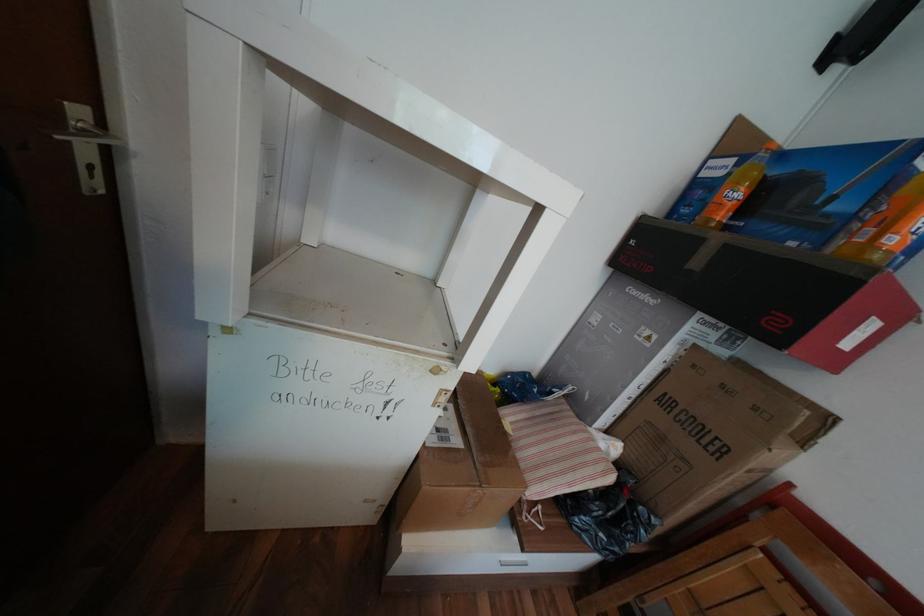
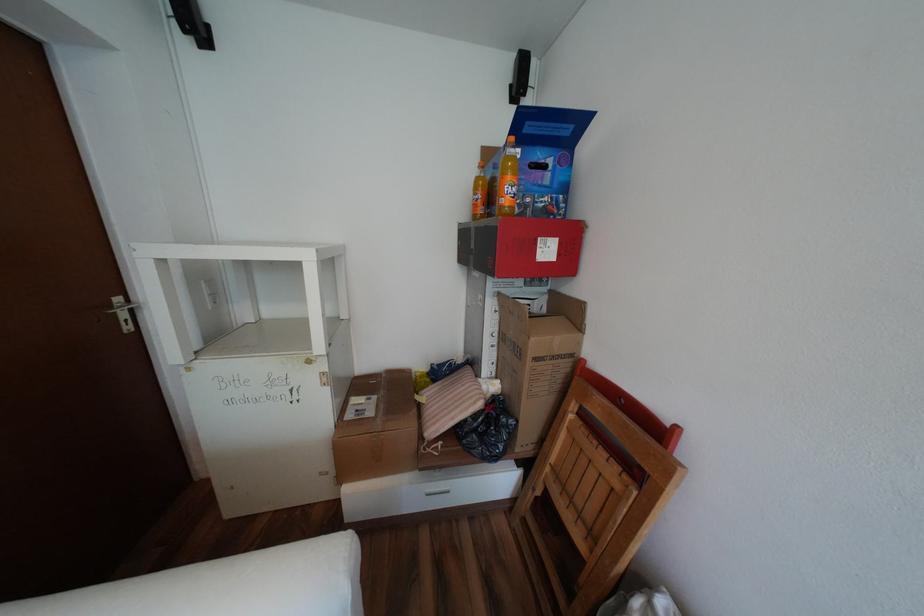
Where in the second image is the point corresponding to point 88,111 from the first image?

(128, 299)